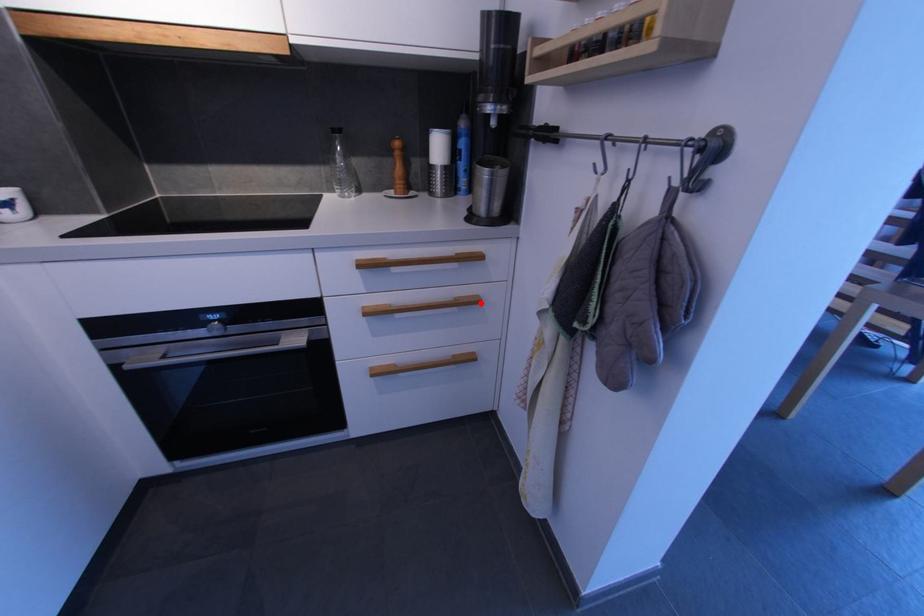
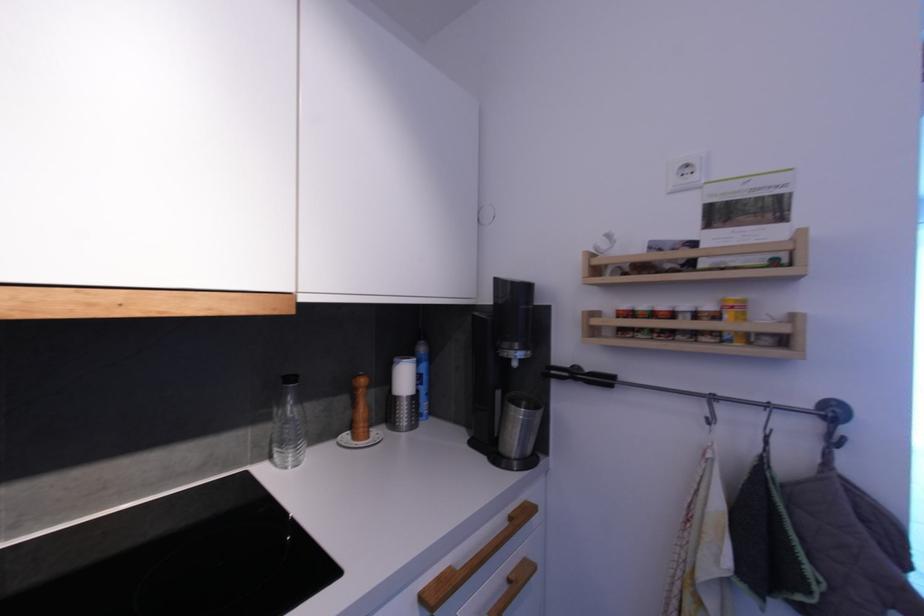
Find the pixel in the second image that matches the highlighted location in the first image.

(532, 570)